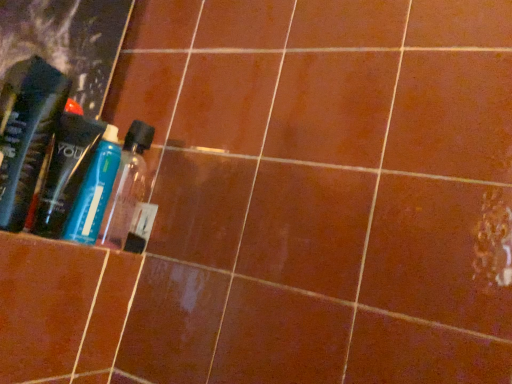
Identify the location of translucent plastic bottle at left. (42, 150).

The image size is (512, 384). Identify the location of transparent plastic bottle at center, the second bottle positioned from the front. (94, 191).

Considering the points (9, 195) and (42, 131), which point is in front, point (9, 195) or point (42, 131)?

Point (9, 195)

In terms of size, does translucent plastic bottle at left appear bigger or smaller than translucent plastic bottle at left, marked as the second bottle in a back-to-front arrangement?

Considering their sizes, translucent plastic bottle at left takes up more space than translucent plastic bottle at left, marked as the second bottle in a back-to-front arrangement.

Would you say translucent plastic bottle at left contains translucent plastic bottle at left, the first bottle from the front?

No, translucent plastic bottle at left, the first bottle from the front, is not inside translucent plastic bottle at left.

Considering their positions, is translucent plastic bottle at left located in front of or behind translucent plastic bottle at left, the first bottle from the front?

In the image, translucent plastic bottle at left appears behind translucent plastic bottle at left, the first bottle from the front.

Considering the sizes of objects translucent plastic bottle at left, the first bottle from the front, and transparent plastic bottle at center, which ranks as the first bottle in back-to-front order, in the image provided, who is smaller, translucent plastic bottle at left, the first bottle from the front, or transparent plastic bottle at center, which ranks as the first bottle in back-to-front order,?

With smaller size is transparent plastic bottle at center, which ranks as the first bottle in back-to-front order.

Can you confirm if translucent plastic bottle at left, the first bottle from the front, is positioned to the right of transparent plastic bottle at center, which ranks as the first bottle in back-to-front order?

In fact, translucent plastic bottle at left, the first bottle from the front, is to the left of transparent plastic bottle at center, which ranks as the first bottle in back-to-front order.

Is translucent plastic bottle at left, the first bottle from the front, oriented away from transparent plastic bottle at center, the second bottle positioned from the front?

Correct, translucent plastic bottle at left, the first bottle from the front, is looking away from transparent plastic bottle at center, the second bottle positioned from the front.

Is translucent plastic bottle at left, marked as the second bottle in a back-to-front arrangement, spatially inside transparent plastic bottle at center, the second bottle positioned from the front, or outside of it?

translucent plastic bottle at left, marked as the second bottle in a back-to-front arrangement, exists outside the volume of transparent plastic bottle at center, the second bottle positioned from the front.

From a real-world perspective, is transparent plastic bottle at center, the second bottle positioned from the front, above or below translucent plastic bottle at left, the first bottle from the front?

transparent plastic bottle at center, the second bottle positioned from the front, is situated lower than translucent plastic bottle at left, the first bottle from the front, in the real world.

In terms of height, does transparent plastic bottle at center, the second bottle positioned from the front, look taller or shorter compared to translucent plastic bottle at left, the first bottle from the front?

In the image, transparent plastic bottle at center, the second bottle positioned from the front, appears to be shorter than translucent plastic bottle at left, the first bottle from the front.

In the scene shown: Which is farther, (93, 237) or (29, 143)?

Positioned behind is point (93, 237).

Which object is further away from the camera taking this photo, transparent plastic bottle at center, which ranks as the first bottle in back-to-front order, or translucent plastic bottle at left, marked as the second bottle in a back-to-front arrangement?

transparent plastic bottle at center, which ranks as the first bottle in back-to-front order.

From the image's perspective, is translucent plastic bottle at left, marked as the second bottle in a back-to-front arrangement, on top of translucent plastic bottle at left?

Incorrect, from the image's perspective, translucent plastic bottle at left, marked as the second bottle in a back-to-front arrangement, is lower than translucent plastic bottle at left.

Looking at this image, is translucent plastic bottle at left, the first bottle from the front, looking in the opposite direction of translucent plastic bottle at left?

translucent plastic bottle at left, the first bottle from the front, does not have its back to translucent plastic bottle at left.

Is translucent plastic bottle at left, the first bottle from the front, with translucent plastic bottle at left?

Yes, translucent plastic bottle at left, the first bottle from the front, is next to translucent plastic bottle at left.

From the image's perspective, between transparent plastic bottle at center, which ranks as the first bottle in back-to-front order, and translucent plastic bottle at left, who is located below?

transparent plastic bottle at center, which ranks as the first bottle in back-to-front order, from the image's perspective.

Is transparent plastic bottle at center, the second bottle positioned from the front, beside translucent plastic bottle at left?

Yes, transparent plastic bottle at center, the second bottle positioned from the front, is with translucent plastic bottle at left.

Considering the sizes of objects transparent plastic bottle at center, which ranks as the first bottle in back-to-front order, and translucent plastic bottle at left in the image provided, who is shorter, transparent plastic bottle at center, which ranks as the first bottle in back-to-front order, or translucent plastic bottle at left?

transparent plastic bottle at center, which ranks as the first bottle in back-to-front order.

Between transparent plastic bottle at center, the second bottle positioned from the front, and translucent plastic bottle at left, which one is positioned in front?

transparent plastic bottle at center, the second bottle positioned from the front, is in front.

Is there a large distance between translucent plastic bottle at left and transparent plastic bottle at center, which ranks as the first bottle in back-to-front order?

No, there isn't a large distance between translucent plastic bottle at left and transparent plastic bottle at center, which ranks as the first bottle in back-to-front order.

Is translucent plastic bottle at left aimed at transparent plastic bottle at center, which ranks as the first bottle in back-to-front order?

No, translucent plastic bottle at left is not aimed at transparent plastic bottle at center, which ranks as the first bottle in back-to-front order.

Between translucent plastic bottle at left and transparent plastic bottle at center, which ranks as the first bottle in back-to-front order, which one has less height?

transparent plastic bottle at center, which ranks as the first bottle in back-to-front order.

At what (x,y) coordinates should I click in order to perform the action: click on bottle that is the 1st one when counting forward from the translucent plastic bottle at left. Please return your answer as a coordinate pair (x, y). Looking at the image, I should click on (x=94, y=191).

Identify the location of the 1st bottle below when counting from the translucent plastic bottle at left (from the image's perspective). This screenshot has height=384, width=512. (28, 135).

At what (x,y) coordinates should I click in order to perform the action: click on bottle in front of the transparent plastic bottle at center, which ranks as the first bottle in back-to-front order. Please return your answer as a coordinate pair (x, y). Looking at the image, I should click on (28, 135).

Considering their positions, is transparent plastic bottle at center, which ranks as the first bottle in back-to-front order, positioned further to translucent plastic bottle at left, the first bottle from the front, than translucent plastic bottle at left?

transparent plastic bottle at center, which ranks as the first bottle in back-to-front order, is positioned further to the anchor translucent plastic bottle at left, the first bottle from the front.

Which object lies nearer to the anchor point transparent plastic bottle at center, which ranks as the first bottle in back-to-front order, translucent plastic bottle at left, marked as the second bottle in a back-to-front arrangement, or translucent plastic bottle at left?

translucent plastic bottle at left lies closer to transparent plastic bottle at center, which ranks as the first bottle in back-to-front order, than the other object.

Based on their spatial positions, is translucent plastic bottle at left, marked as the second bottle in a back-to-front arrangement, or transparent plastic bottle at center, which ranks as the first bottle in back-to-front order, closer to translucent plastic bottle at left?

Based on the image, translucent plastic bottle at left, marked as the second bottle in a back-to-front arrangement, appears to be nearer to translucent plastic bottle at left.

Based on their spatial positions, is translucent plastic bottle at left or transparent plastic bottle at center, which ranks as the first bottle in back-to-front order, closer to translucent plastic bottle at left, the first bottle from the front?

translucent plastic bottle at left is positioned closer to the anchor translucent plastic bottle at left, the first bottle from the front.

Which object lies further to the anchor point transparent plastic bottle at center, which ranks as the first bottle in back-to-front order, translucent plastic bottle at left or translucent plastic bottle at left, marked as the second bottle in a back-to-front arrangement?

translucent plastic bottle at left, marked as the second bottle in a back-to-front arrangement, is further to transparent plastic bottle at center, which ranks as the first bottle in back-to-front order.

From the picture: Which object lies nearer to the anchor point translucent plastic bottle at left, transparent plastic bottle at center, the second bottle positioned from the front, or translucent plastic bottle at left, the first bottle from the front?

translucent plastic bottle at left, the first bottle from the front, is positioned closer to the anchor translucent plastic bottle at left.

Image resolution: width=512 pixels, height=384 pixels. I want to click on bottle located between translucent plastic bottle at left and transparent plastic bottle at center, which ranks as the first bottle in back-to-front order, in the left-right direction, so click(28, 135).